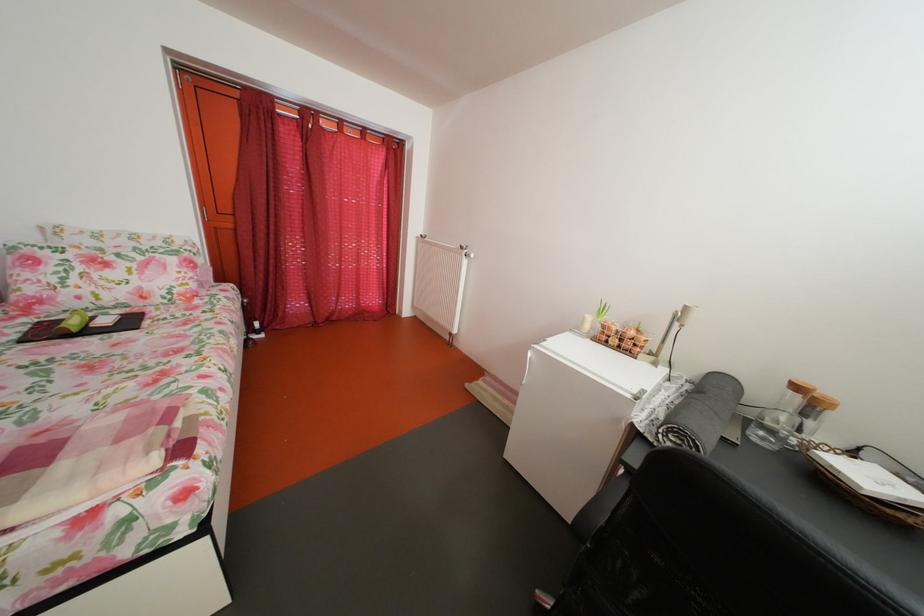
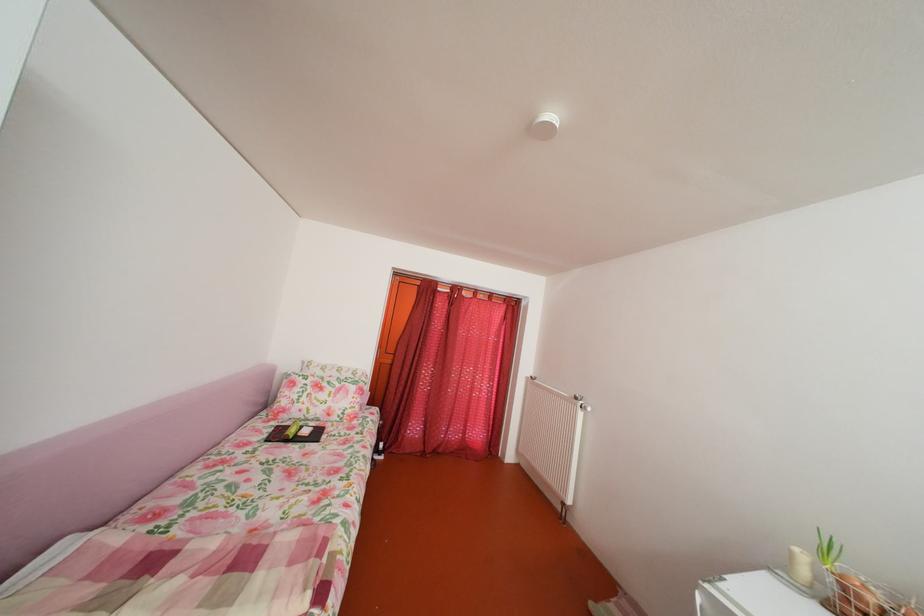
In the second image, find the point that corresponds to point 393,190 in the first image.

(511, 337)